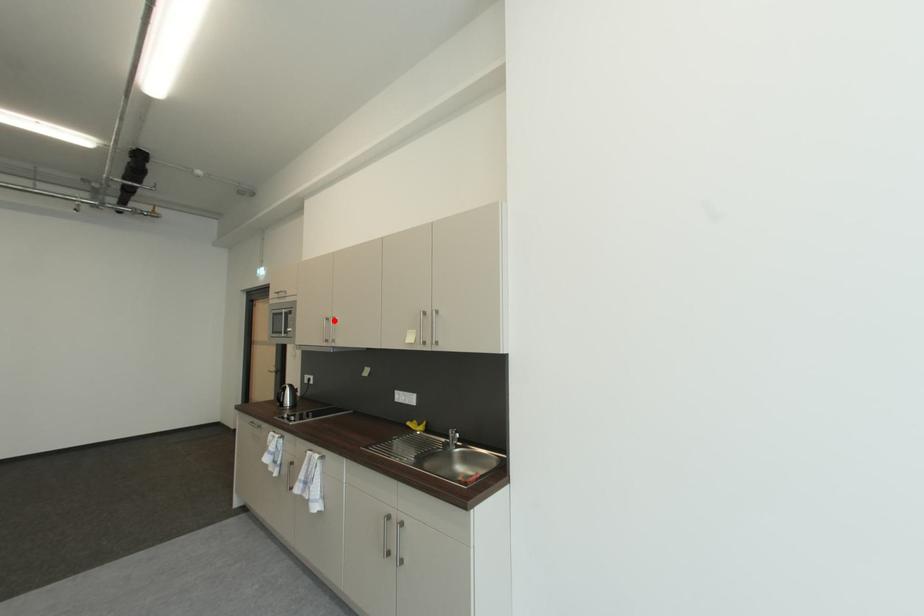
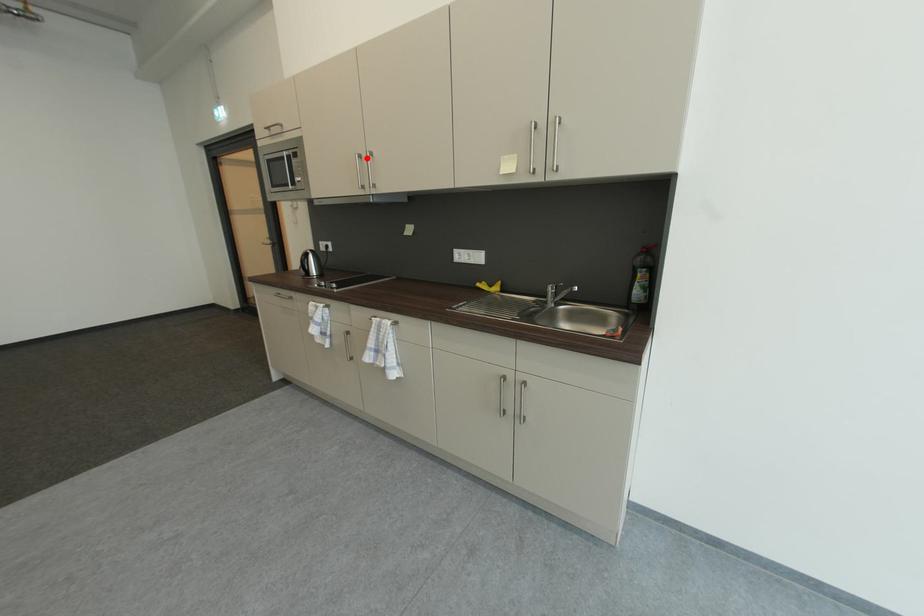
I am providing you with two images of the same scene from different viewpoints. A red point is marked on the first image and another point is marked on the second image. Does the point marked in image1 correspond to the same location as the one in image2?

Yes